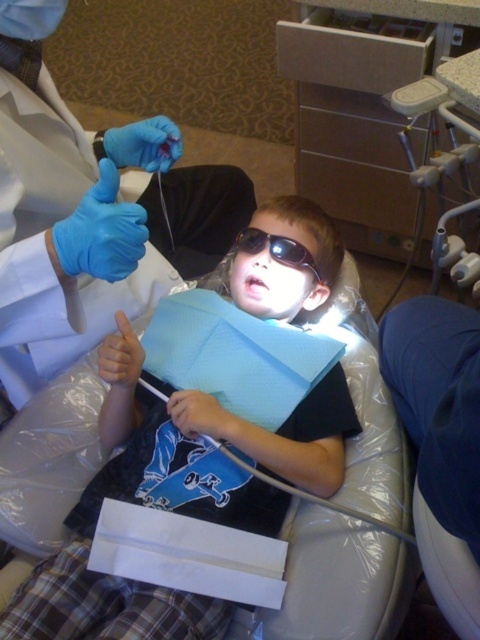
A dentist needs to ensure proper distance between their gloves and the patient to avoid contamination. Given that the blue latex gloves at upper left are 38.65 centimeters away from the smooth skin mouth at center, is this distance sufficient to maintain hygiene standards?

The blue latex gloves at upper left is 38.65 centimeters from the smooth skin mouth at center, which is sufficient distance to maintain hygiene standards as it prevents direct contact between the gloves and the mouth area.

You are a dental assistant and need to place a new pair of black plastic goggles at center on the tray next to the blue latex gloves at upper left. Can you place them to the right of the gloves?

The blue latex gloves at upper left is to the left of black plastic goggles at center, so yes, the black plastic goggles at center can be placed to the right of the blue latex gloves at upper left.